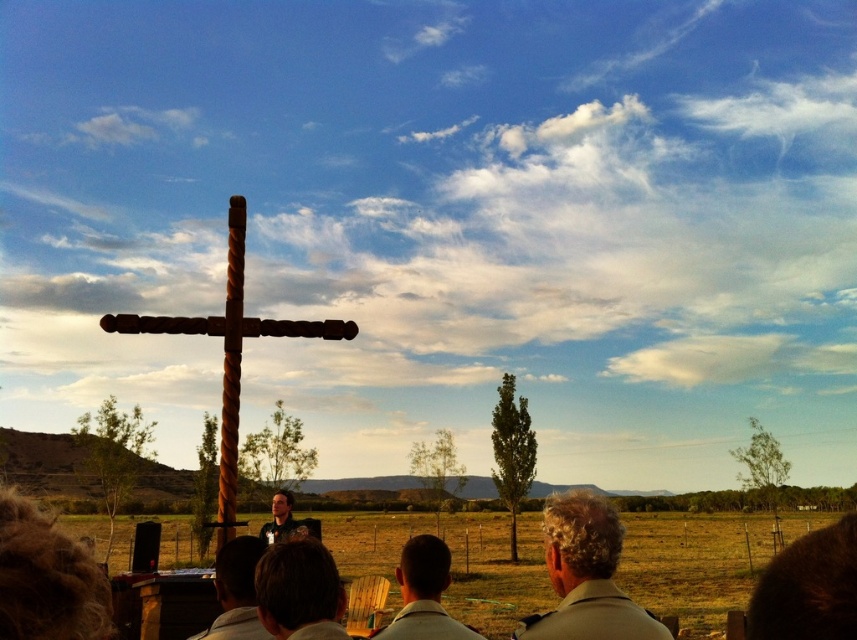
You are a photographer who wants to capture a closeup of the light beige shirt at center and smooth brown hair at center. Since you can only focus on one subject at a time, which one should you choose to ensure it appears in focus without needing to adjust the camera focus afterward?

The light beige shirt at center is taller than smooth brown hair at center, so focusing on the light beige shirt at center first would ensure it stays in focus as the smooth brown hair at center is closer and within the same focal plane.

You are a photographer trying to capture a closeup of the dark brown hair at lower center and the light brown wooden chair at lower center. Based on their sizes, which one would require you to move closer to get a detailed shot?

The dark brown hair at lower center has a smaller width than the light brown wooden chair at lower center, so you would need to move closer to the dark brown hair at lower center to capture its details.